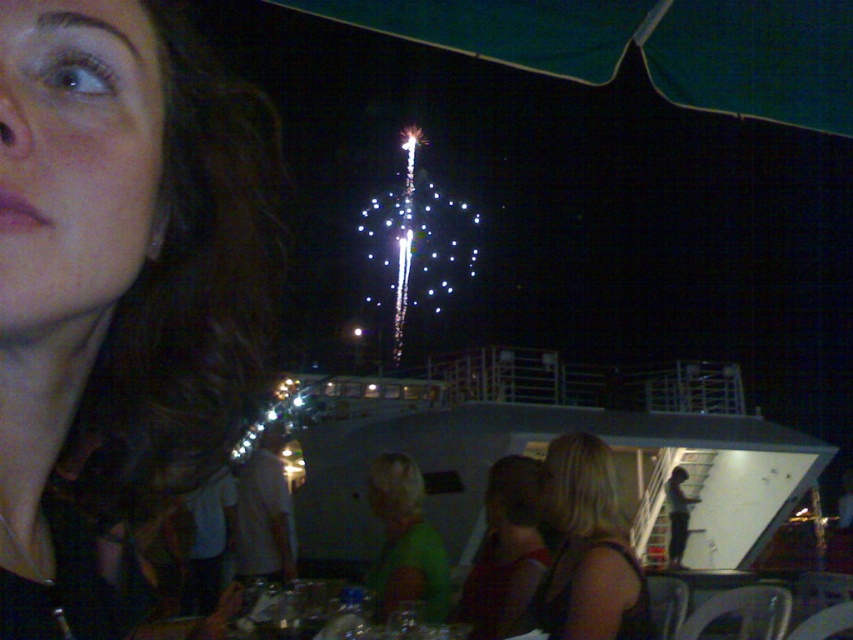
Can you confirm if matte black hair at upper left is shorter than blonde hair at lower right?

Indeed, matte black hair at upper left has a lesser height compared to blonde hair at lower right.

Does matte black hair at upper left have a greater width compared to blonde hair at lower right?

No, matte black hair at upper left is not wider than blonde hair at lower right.

This screenshot has width=853, height=640. I want to click on matte black hair at upper left, so click(119, 275).

You are a GUI agent. You are given a task and a screenshot of the screen. Output one action in this format:
    pyautogui.click(x=<x>, y=<y>)
    Task: Click on the matte black hair at upper left
    
    Given the screenshot: What is the action you would take?
    pyautogui.click(x=119, y=275)